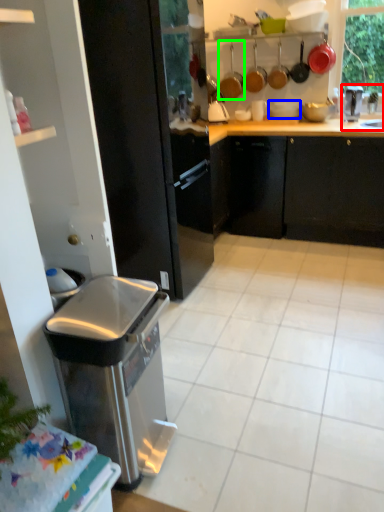
Question: Which object is the farthest from sink (highlighted by a red box)? Choose among these: appliance (highlighted by a blue box) or appliance (highlighted by a green box).

Choices:
 (A) appliance
 (B) appliance

Answer: (B)